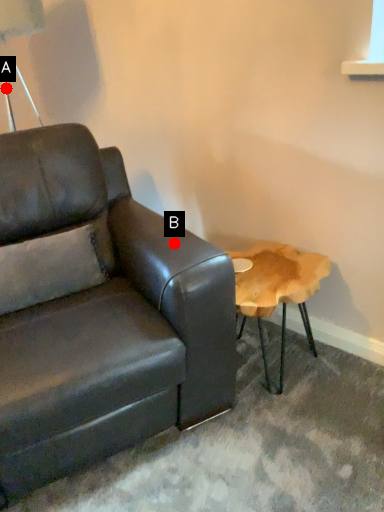
Question: Two points are circled on the image, labeled by A and B beside each circle. Which of the following is the farthest from the observer?

Choices:
 (A) A is further
 (B) B is further

Answer: (A)